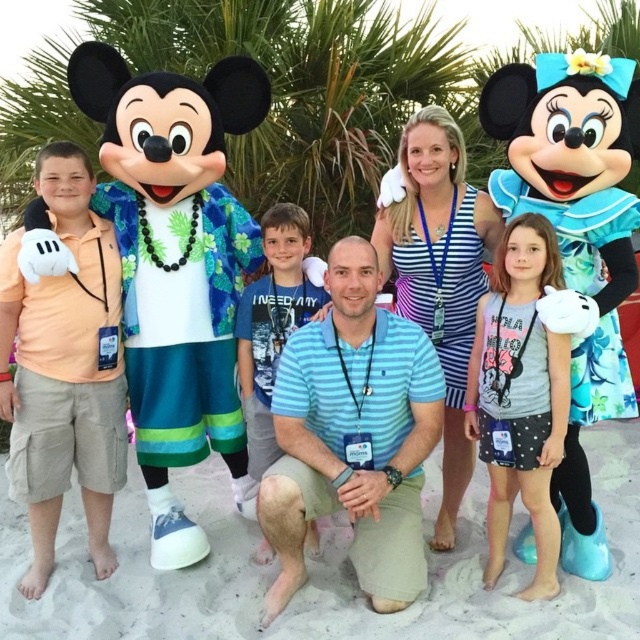
Question: Considering the real-world distances, which object is closest to the blue cotton shirt at center?

Choices:
 (A) beige sand at center
 (B) white dotted fabric dress at lower right

Answer: (B)

Question: Does beige sand at center have a larger size compared to white dotted fabric dress at lower right?

Choices:
 (A) yes
 (B) no

Answer: (A)

Question: Among these objects, which one is nearest to the camera?

Choices:
 (A) beige sand at center
 (B) blue cotton shirt at center

Answer: (A)

Question: Can you confirm if beige sand at center is smaller than white dotted fabric dress at lower right?

Choices:
 (A) yes
 (B) no

Answer: (B)

Question: Which object is positioned farthest from the white dotted fabric dress at lower right?

Choices:
 (A) blue cotton shirt at center
 (B) beige sand at center

Answer: (A)

Question: Can you confirm if white dotted fabric dress at lower right is positioned to the right of blue cotton shirt at center?

Choices:
 (A) yes
 (B) no

Answer: (A)